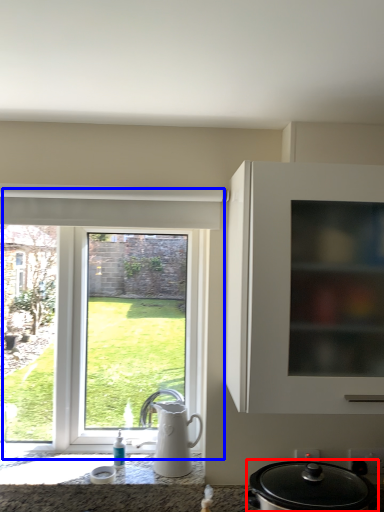
Question: Which object appears farthest to the camera in this image, kitchen appliance (highlighted by a red box) or window (highlighted by a blue box)?

Choices:
 (A) kitchen appliance
 (B) window

Answer: (B)